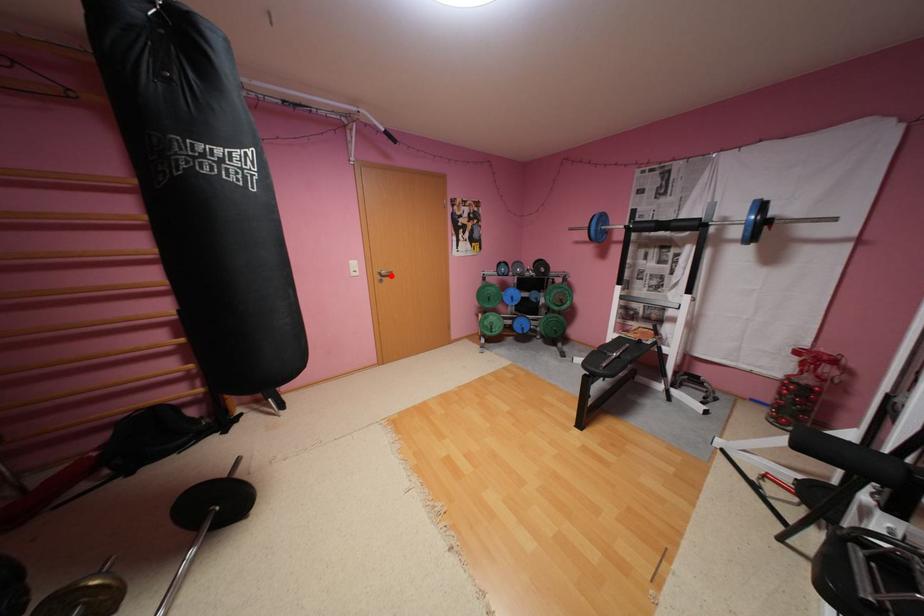
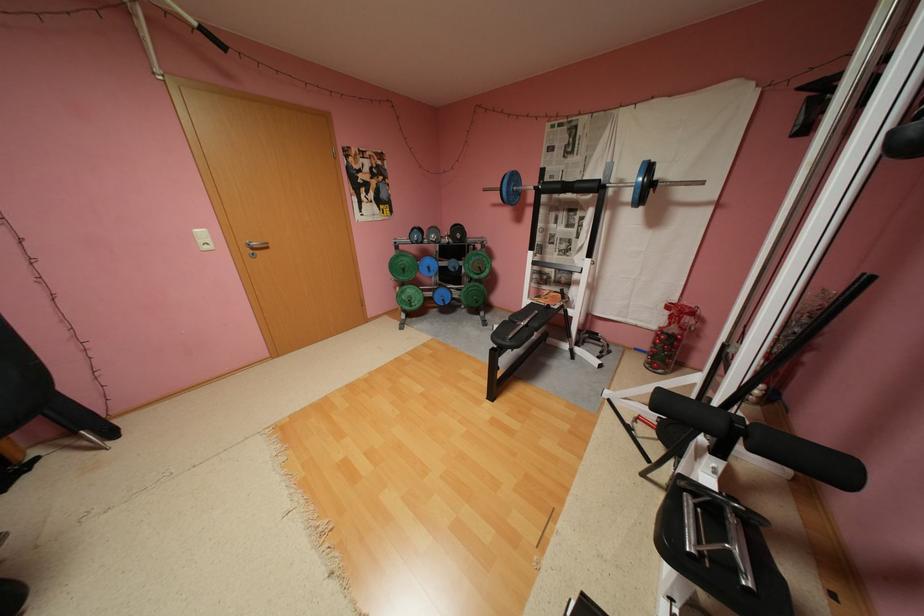
In the second image, find the point that corresponds to the highlighted location in the first image.

(262, 249)